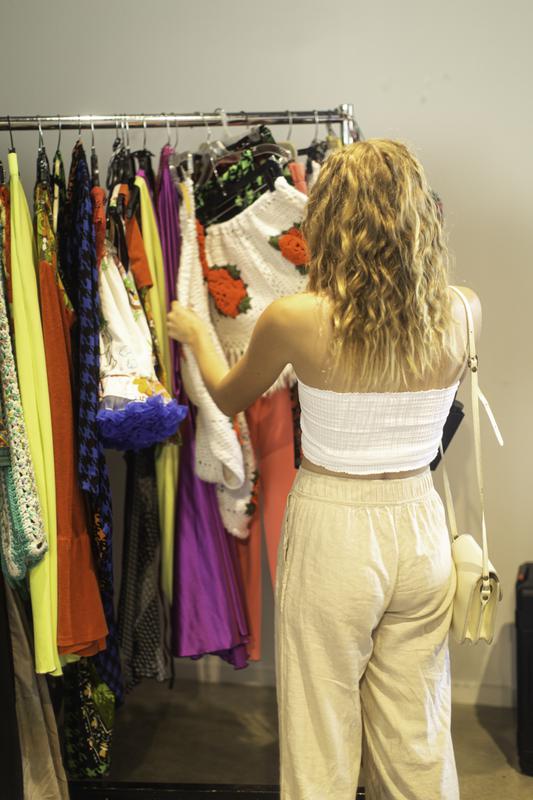
Locate an element on the screen. floor is located at coordinates (496, 766).